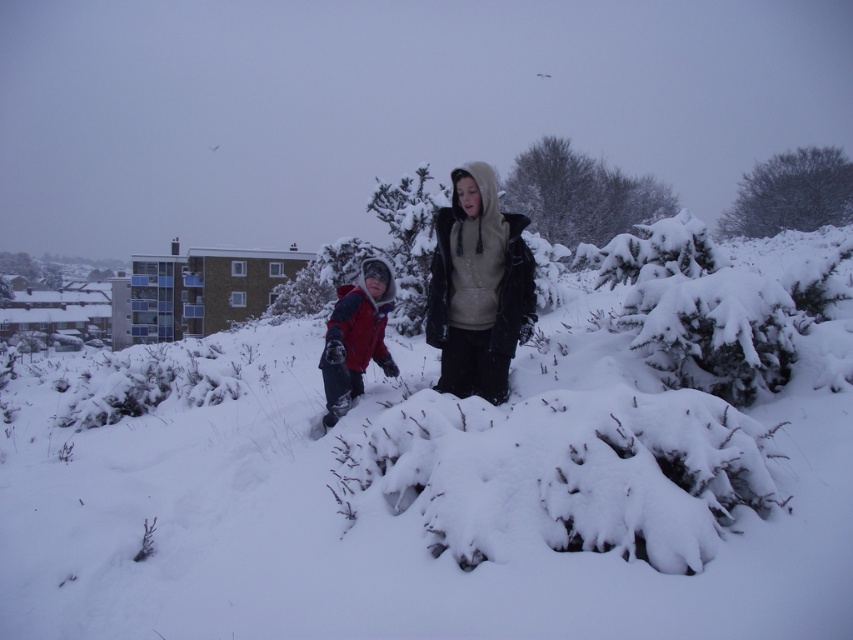
You are standing in the snowy outdoor scene and want to determine which of the two points, point (454, 339) or point (752, 230), is nearer to you. Based on the description, which point is closer?

Point (454, 339) is closer to the viewer than point (752, 230).